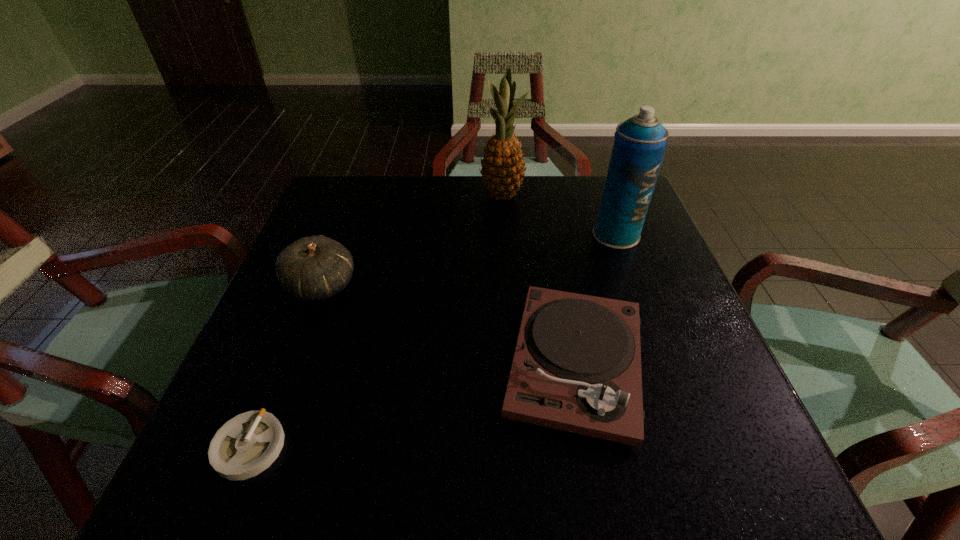
Where is `vacant point that satisfies the following two spatial constraints: 1. on the back side of the phonograph_record; 2. on the left side of the second farthest object`? vacant point that satisfies the following two spatial constraints: 1. on the back side of the phonograph_record; 2. on the left side of the second farthest object is located at coordinates (550, 235).

Locate an element on the screen. The height and width of the screenshot is (540, 960). free space that satisfies the following two spatial constraints: 1. on the back side of the shortest object; 2. on the right side of the phonograph_record is located at coordinates (283, 363).